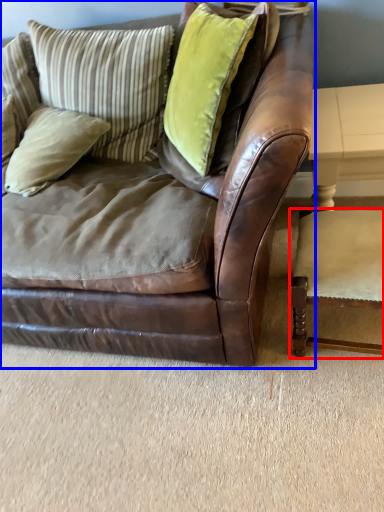
Question: Which object is closer to the camera taking this photo, chair (highlighted by a red box) or studio couch (highlighted by a blue box)?

Choices:
 (A) chair
 (B) studio couch

Answer: (B)